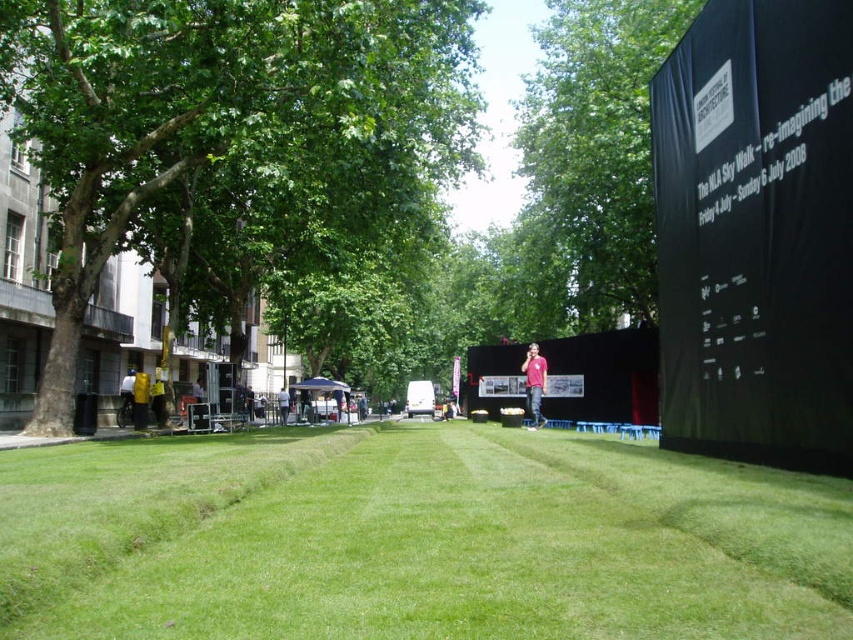
Question: Which object is positioned closest to the green leafy tree at upper center?

Choices:
 (A) green grass at center
 (B) green leafy tree at left

Answer: (B)

Question: Is the position of green grass at center less distant than that of green leafy tree at left?

Choices:
 (A) yes
 (B) no

Answer: (A)

Question: Can you confirm if green leafy tree at left is thinner than green leafy tree at upper center?

Choices:
 (A) yes
 (B) no

Answer: (B)

Question: Which point is farther to the camera?

Choices:
 (A) green leafy tree at left
 (B) green grass at center

Answer: (A)

Question: Does green grass at center appear on the left side of green leafy tree at left?

Choices:
 (A) yes
 (B) no

Answer: (B)

Question: Which is nearer to the green leafy tree at left?

Choices:
 (A) green grass at center
 (B) green leafy tree at upper center

Answer: (A)